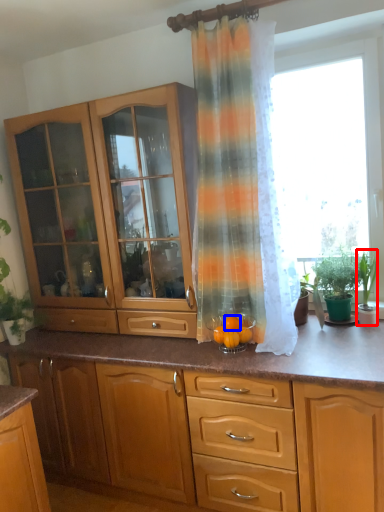
Question: Which object is closer to the camera taking this photo, houseplant (highlighted by a red box) or orange (highlighted by a blue box)?

Choices:
 (A) houseplant
 (B) orange

Answer: (B)